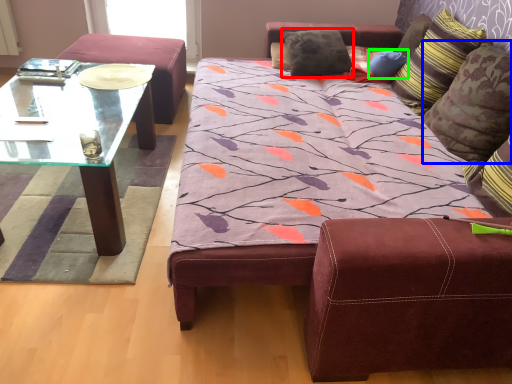
Question: Which object is the closest to the pillow (highlighted by a red box)? Choose among these: pillow (highlighted by a blue box) or pillow (highlighted by a green box).

Choices:
 (A) pillow
 (B) pillow

Answer: (B)